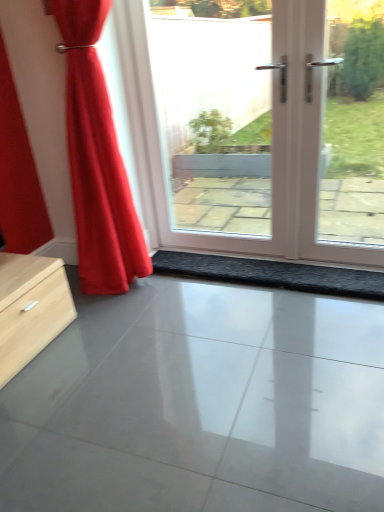
You are a GUI agent. You are given a task and a screenshot of the screen. Output one action in this format:
    pyautogui.click(x=<x>, y=<y>)
    Task: Click on the free region under satin red curtain at left (from a real-world perspective)
    This screenshot has height=512, width=384.
    Given the screenshot: What is the action you would take?
    pyautogui.click(x=145, y=286)